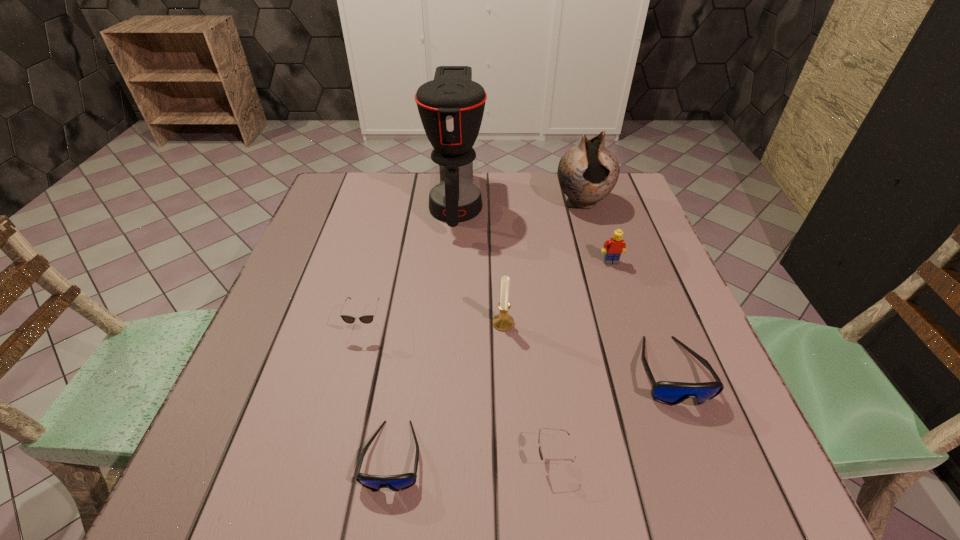
Where is `blank space at the far edge`? blank space at the far edge is located at coordinates (524, 192).

Find the location of `vacant area at the left edge of the desktop`. vacant area at the left edge of the desktop is located at coordinates (319, 220).

Identify the location of free region at the right edge of the desktop. This screenshot has width=960, height=540. (731, 420).

This screenshot has height=540, width=960. In the image, there is a desktop. What are the coordinates of `free region at the near left corner` in the screenshot? It's located at (254, 474).

The width and height of the screenshot is (960, 540). In the image, there is a desktop. What are the coordinates of `free space at the near right corner` in the screenshot? It's located at (771, 511).

This screenshot has width=960, height=540. What are the coordinates of `free space that is in between the seventh shortest object and the sixth nearest object` in the screenshot? It's located at (597, 232).

The image size is (960, 540). Identify the location of free space between the shortest object and the coffee maker. (424, 330).

You are a GUI agent. You are given a task and a screenshot of the screen. Output one action in this format:
    pyautogui.click(x=<x>, y=<y>)
    Task: Click on the free space between the fourth tallest object and the pottery
    This screenshot has width=960, height=540.
    Given the screenshot: What is the action you would take?
    pyautogui.click(x=597, y=232)

I want to click on vacant area that lies between the pottery and the farther blue sunglasses, so click(x=627, y=287).

You are a GUI agent. You are given a task and a screenshot of the screen. Output one action in this format:
    pyautogui.click(x=<x>, y=<y>)
    Task: Click on the free space between the coffee maker and the farther black sunglasses
    
    Given the screenshot: What is the action you would take?
    pyautogui.click(x=411, y=265)